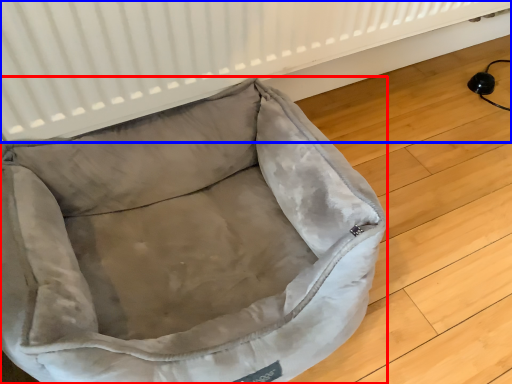
Question: Among these objects, which one is farthest to the camera, dog bed (highlighted by a red box) or radiator (highlighted by a blue box)?

Choices:
 (A) dog bed
 (B) radiator

Answer: (B)